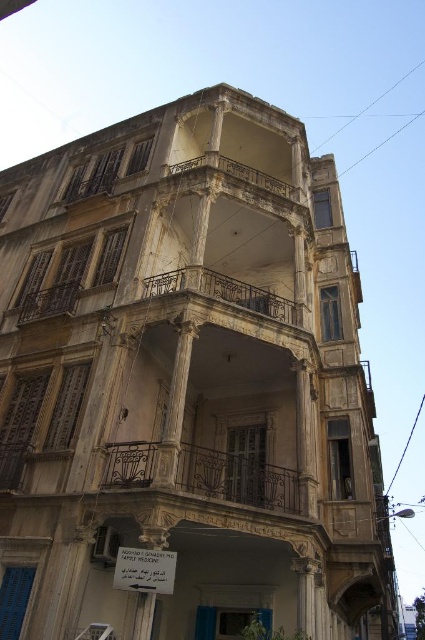
Does rustic wrought iron balcony at center have a larger size compared to rusty metal balcony at center?

Indeed, rustic wrought iron balcony at center has a larger size compared to rusty metal balcony at center.

Measure the distance between rustic wrought iron balcony at center and camera.

The distance of rustic wrought iron balcony at center from camera is 25.98 meters.

At what (x,y) coordinates should I click in order to perform the action: click on rustic wrought iron balcony at center. Please return your answer as a coordinate pair (x, y). The width and height of the screenshot is (425, 640). Looking at the image, I should click on (237, 480).